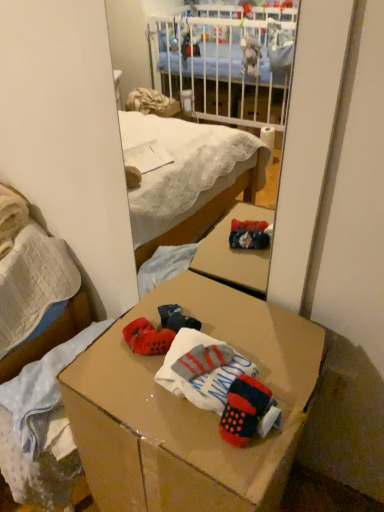
Find the location of a particular element. The image size is (384, 512). vacant region to the left of knitted wool socks at center is located at coordinates (155, 414).